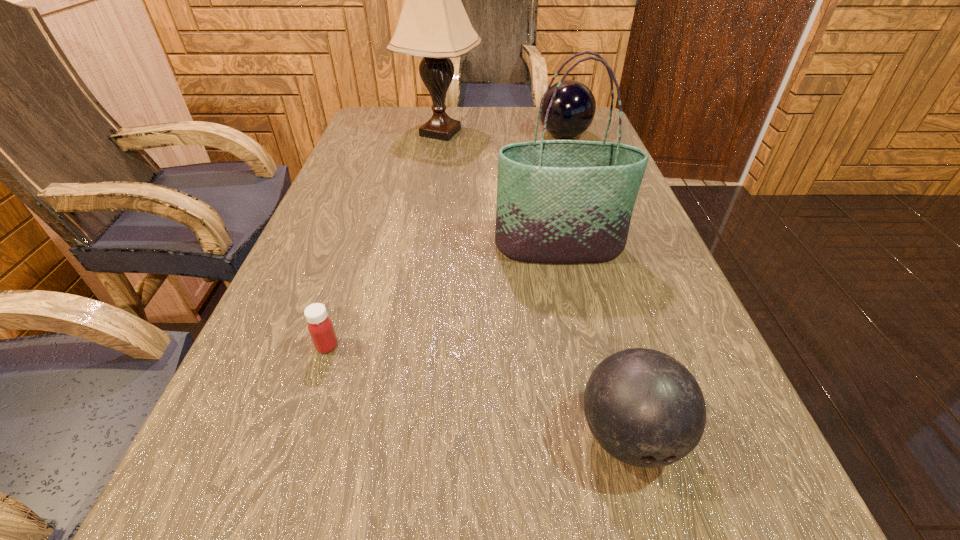
At what (x,y) coordinates should I click in order to perform the action: click on free space located on the side of the farther bowling ball with the finger holes. Please return your answer as a coordinate pair (x, y). Looking at the image, I should click on (423, 136).

Image resolution: width=960 pixels, height=540 pixels. I want to click on vacant area located on the side of the farther bowling ball with the finger holes, so click(x=484, y=136).

At what (x,y) coordinates should I click in order to perform the action: click on free point located on the grip area of the nearest object. Please return your answer as a coordinate pair (x, y). Looking at the image, I should click on (656, 534).

Locate an element on the screen. Image resolution: width=960 pixels, height=540 pixels. blank area located 0.090m on the back of the shortest object is located at coordinates (343, 300).

Image resolution: width=960 pixels, height=540 pixels. Find the location of `lamp that is positioned at the far edge`. lamp that is positioned at the far edge is located at coordinates (433, 23).

Locate an element on the screen. bowling ball present at the far edge is located at coordinates (573, 109).

At what (x,y) coordinates should I click in order to perform the action: click on lamp at the left edge. Please return your answer as a coordinate pair (x, y). The height and width of the screenshot is (540, 960). Looking at the image, I should click on [x=433, y=23].

What are the coordinates of `medicine that is positioned at the left edge` in the screenshot? It's located at (320, 327).

The width and height of the screenshot is (960, 540). Find the location of `tote bag positioned at the right edge`. tote bag positioned at the right edge is located at coordinates (558, 201).

Identify the location of object at the far left corner. This screenshot has height=540, width=960. (433, 23).